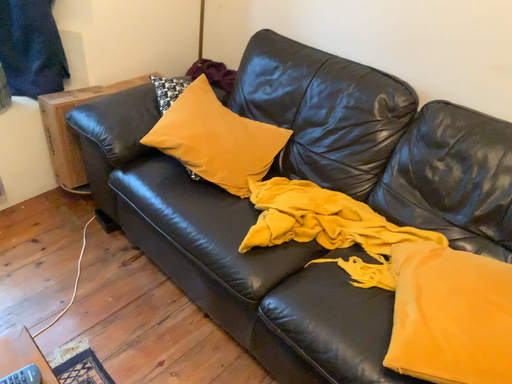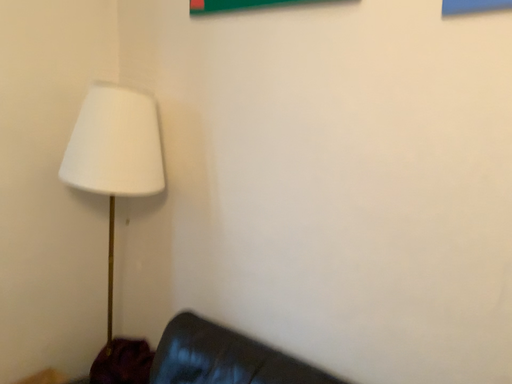
Question: Which way did the camera rotate in the video?

Choices:
 (A) rotated upward
 (B) rotated downward

Answer: (A)